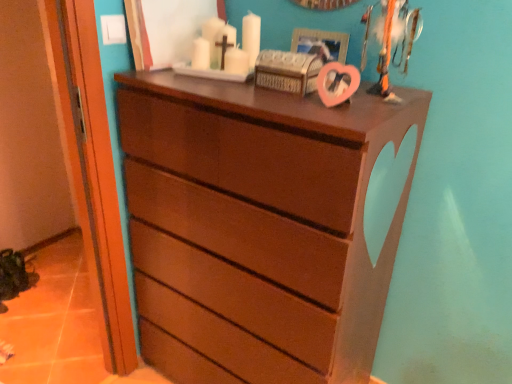
Question: Does point (101, 122) appear closer or farther from the camera than point (354, 228)?

Choices:
 (A) farther
 (B) closer

Answer: (A)

Question: From a real-world perspective, is matte wood door at left positioned above or below matte brown chest of drawers at center?

Choices:
 (A) below
 (B) above

Answer: (B)

Question: Estimate the real-world distances between objects in this image. Which object is closer to the metallic silver trophy at upper right?

Choices:
 (A) matte brown chest of drawers at center
 (B) pink matte picture frame at upper center
 (C) matte wood door at left

Answer: (B)

Question: Based on their relative distances, which object is farther from the matte brown chest of drawers at center?

Choices:
 (A) metallic silver trophy at upper right
 (B) pink matte picture frame at upper center
 (C) matte wood door at left

Answer: (B)